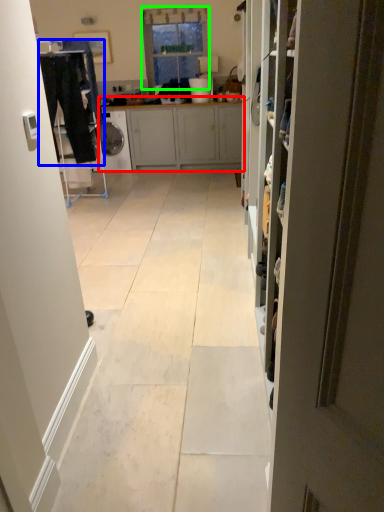
Question: Estimate the real-world distances between objects in this image. Which object is farther from cabinetry (highlighted by a red box), laundry (highlighted by a blue box) or window (highlighted by a green box)?

Choices:
 (A) laundry
 (B) window

Answer: (A)